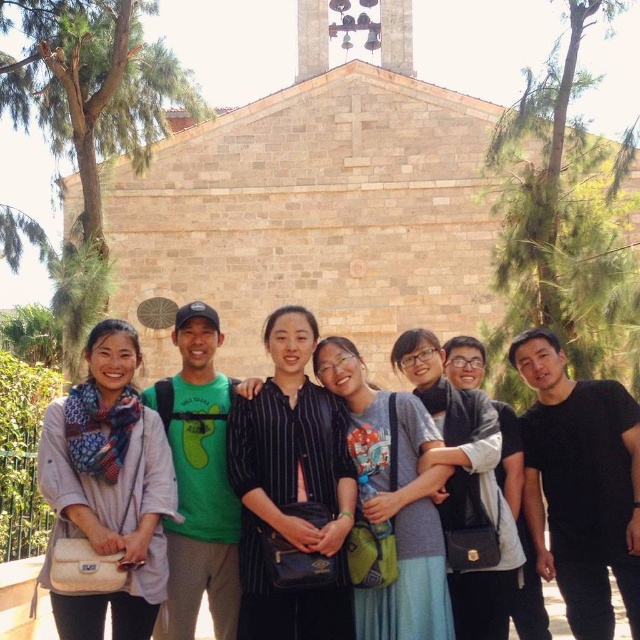
Based on the photo, you are a photographer taking a photo of the group in front of the church. You notice the matte scarf at left and the striped shirt at center. Which object should you focus on if you want to capture a larger subject in the frame?

The striped shirt at center is larger than the matte scarf at left, so focusing on the striped shirt at center would capture a larger subject in the frame.